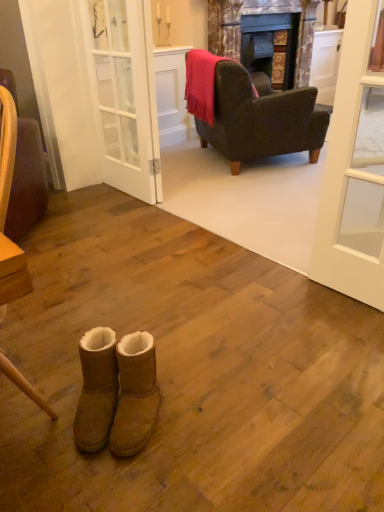
At what (x,y) coordinates should I click in order to perform the action: click on white glass door at upper right. Please return your answer as a coordinate pair (x, y). Looking at the image, I should click on (354, 173).

I want to click on velvet purple chair at left, arranged as the first chair when viewed from the front, so click(x=25, y=172).

The image size is (384, 512). Describe the element at coordinates (25, 172) in the screenshot. I see `velvet purple chair at left, which appears as the first chair when viewed from the left` at that location.

In order to face velvet pink throw at upper center, should I rotate leftwards or rightwards?

Turn right approximately 2.570 degrees to face it.

Image resolution: width=384 pixels, height=512 pixels. I want to click on white glass door at upper right, so click(x=354, y=173).

Does brown suede boots at lower center, which is counted as the second footwear, starting from the right, appear on the left side of tan suede boots at lower center, the first footwear viewed from the right?

Yes.

Looking at this image, who is taller, brown suede boots at lower center, placed as the first footwear when sorted from left to right, or tan suede boots at lower center, the 2th footwear viewed from the left?

tan suede boots at lower center, the 2th footwear viewed from the left.

The width and height of the screenshot is (384, 512). What are the coordinates of `footwear in front of the brown suede boots at lower center, placed as the first footwear when sorted from left to right` in the screenshot? It's located at (135, 394).

What's the angular difference between brown suede boots at lower center, placed as the first footwear when sorted from left to right, and tan suede boots at lower center, the 2th footwear viewed from the left,'s facing directions?

0.592 degrees.

Considering the positions of objects white glass door at center and white glass door at upper right in the image provided, who is in front, white glass door at center or white glass door at upper right?

white glass door at upper right.

From a real-world perspective, between white glass door at center and white glass door at upper right, who is vertically higher?

white glass door at center, from a real-world perspective.

From the image's perspective, does white glass door at center appear higher than white glass door at upper right?

Yes, from the image's perspective, white glass door at center is over white glass door at upper right.

From their relative heights in the image, would you say white glass door at center is taller or shorter than white glass door at upper right?

Considering their sizes, white glass door at center has more height than white glass door at upper right.

Between velvet pink throw at upper center and tan suede boots at lower center, the first footwear viewed from the right, which one appears on the right side from the viewer's perspective?

From the viewer's perspective, velvet pink throw at upper center appears more on the right side.

Considering the sizes of objects velvet pink throw at upper center and tan suede boots at lower center, the 2th footwear viewed from the left, in the image provided, who is thinner, velvet pink throw at upper center or tan suede boots at lower center, the 2th footwear viewed from the left,?

Thinner between the two is velvet pink throw at upper center.

Considering their positions, is velvet pink throw at upper center located in front of or behind tan suede boots at lower center, the first footwear viewed from the right?

velvet pink throw at upper center is positioned farther from the viewer than tan suede boots at lower center, the first footwear viewed from the right.

From the image's perspective, which object appears higher, brown suede boots at lower center, which is counted as the second footwear, starting from the right, or white glass door at center?

From the image's view, white glass door at center is above.

Is brown suede boots at lower center, placed as the first footwear when sorted from left to right, directly adjacent to white glass door at center?

brown suede boots at lower center, placed as the first footwear when sorted from left to right, and white glass door at center are clearly separated.

Consider the image. Could you measure the distance between brown suede boots at lower center, which is counted as the second footwear, starting from the right, and white glass door at center?

5.77 feet.

Does brown suede boots at lower center, which is counted as the second footwear, starting from the right, have a lesser height compared to white glass door at center?

Correct, brown suede boots at lower center, which is counted as the second footwear, starting from the right, is not as tall as white glass door at center.

From the image's perspective, is tan suede boots at lower center, the 2th footwear viewed from the left, on top of white glass door at center?

Incorrect, from the image's perspective, tan suede boots at lower center, the 2th footwear viewed from the left, is lower than white glass door at center.

From a real-world perspective, is tan suede boots at lower center, the first footwear viewed from the right, physically located above or below white glass door at center?

Clearly, from a real-world perspective, tan suede boots at lower center, the first footwear viewed from the right, is below white glass door at center.

Consider the image. Is tan suede boots at lower center, the first footwear viewed from the right, completely or partially outside of white glass door at center?

Yes, tan suede boots at lower center, the first footwear viewed from the right, is outside of white glass door at center.

Is tan suede boots at lower center, the 2th footwear viewed from the left, oriented away from white glass door at center?

That's not correct — tan suede boots at lower center, the 2th footwear viewed from the left, is not looking away from white glass door at center.

In the scene shown: Could you tell me if white glass door at upper right is turned towards velvet purple chair at left, marked as the second chair in a back-to-front arrangement?

No, white glass door at upper right is not facing towards velvet purple chair at left, marked as the second chair in a back-to-front arrangement.

From a real-world perspective, is white glass door at upper right over velvet purple chair at left, arranged as the first chair when viewed from the front?

Yes.

From the image's perspective, count 1st chairs upward from the white glass door at upper right and point to it. Please provide its 2D coordinates.

[(25, 172)]

Can you see white glass door at upper right touching velvet purple chair at left, the 2th chair positioned from the right?

No.

Consider the image. Can white glass door at center be found inside marble fireplace at center?

Actually, white glass door at center is outside marble fireplace at center.

Is the position of marble fireplace at center less distant than that of white glass door at center?

No, it is behind white glass door at center.

Where is `screen door below the marble fireplace at center (from a real-world perspective)`? screen door below the marble fireplace at center (from a real-world perspective) is located at coordinates (x=124, y=94).

From a real-world perspective, is marble fireplace at center physically below white glass door at center?

No.

Locate an element on the screen. This screenshot has width=384, height=512. footwear behind the tan suede boots at lower center, the first footwear viewed from the right is located at coordinates click(x=96, y=389).

Identify the location of screen door above the white glass door at upper right (from a real-world perspective). Image resolution: width=384 pixels, height=512 pixels. (124, 94).

Looking at the image, which one is located further to white glass door at upper right, brown suede boots at lower center, placed as the first footwear when sorted from left to right, or marble fireplace at center?

marble fireplace at center is positioned further to the anchor white glass door at upper right.

Looking at this image, from the image, which object appears to be nearer to velvet pink throw at upper center, white glass door at center or tan suede boots at lower center, the 2th footwear viewed from the left?

Based on the image, white glass door at center appears to be nearer to velvet pink throw at upper center.

Looking at the image, which one is located closer to dark brown leather armchair at upper right, placed as the 2th chair when sorted from front to back, brown suede boots at lower center, placed as the first footwear when sorted from left to right, or velvet purple chair at left, which appears as the first chair when viewed from the left?

Among the two, velvet purple chair at left, which appears as the first chair when viewed from the left, is located nearer to dark brown leather armchair at upper right, placed as the 2th chair when sorted from front to back.

Based on their spatial positions, is white glass door at upper right or dark brown leather armchair at upper right, which is the first chair in right-to-left order, closer to brown suede boots at lower center, which is counted as the second footwear, starting from the right?

Based on the image, white glass door at upper right appears to be nearer to brown suede boots at lower center, which is counted as the second footwear, starting from the right.

Based on their spatial positions, is white glass door at upper right or brown suede boots at lower center, placed as the first footwear when sorted from left to right, closer to white glass door at center?

white glass door at upper right lies closer to white glass door at center than the other object.

Estimate the real-world distances between objects in this image. Which object is closer to white glass door at center, dark brown leather armchair at upper right, acting as the 2th chair starting from the left, or white glass door at upper right?

dark brown leather armchair at upper right, acting as the 2th chair starting from the left, is positioned closer to the anchor white glass door at center.

Looking at the image, which one is located closer to white glass door at upper right, velvet pink throw at upper center or brown suede boots at lower center, which is counted as the second footwear, starting from the right?

Based on the image, brown suede boots at lower center, which is counted as the second footwear, starting from the right, appears to be nearer to white glass door at upper right.

Looking at the image, which one is located closer to velvet pink throw at upper center, marble fireplace at center or white glass door at center?

Based on the image, white glass door at center appears to be nearer to velvet pink throw at upper center.

The height and width of the screenshot is (512, 384). I want to click on door between tan suede boots at lower center, the 2th footwear viewed from the left, and marble fireplace at center from front to back, so click(x=354, y=173).

Find the location of a particular element. The width and height of the screenshot is (384, 512). screen door between marble fireplace at center and tan suede boots at lower center, the first footwear viewed from the right, in the vertical direction is located at coordinates (124, 94).

This screenshot has width=384, height=512. In order to click on blanket between velvet purple chair at left, marked as the second chair in a back-to-front arrangement, and white glass door at upper right, in the horizontal direction in this screenshot , I will do `click(202, 83)`.

This screenshot has height=512, width=384. In order to click on blanket between white glass door at upper right and marble fireplace at center in the front-back direction in this screenshot , I will do `click(202, 83)`.